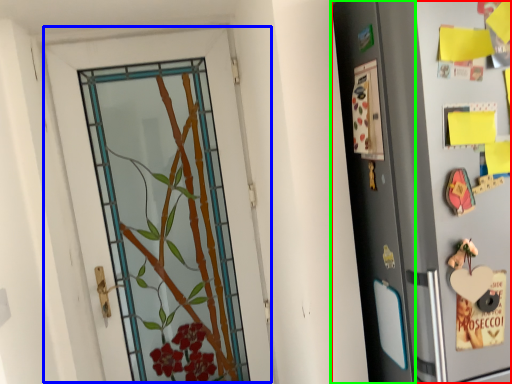
Question: Considering the real-world distances, which object is closest to refrigerator (highlighted by a red box)? door (highlighted by a blue box) or screen door (highlighted by a green box).

Choices:
 (A) door
 (B) screen door

Answer: (B)